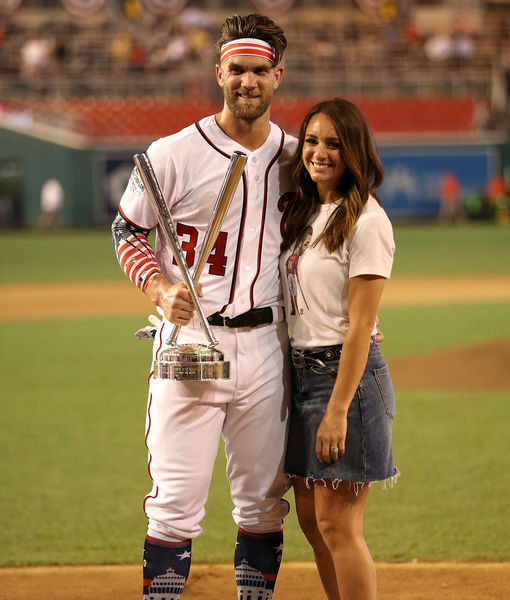
Locate an element on the screen. This screenshot has height=600, width=510. trophy is located at coordinates (188, 359).